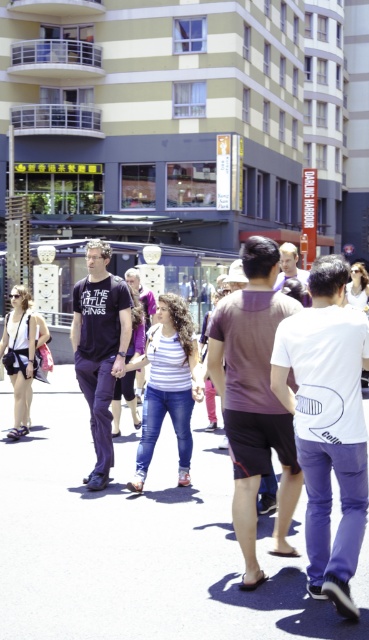
Based on the photo, who is more forward, (338, 275) or (247, 344)?

Positioned in front is point (338, 275).

Can you confirm if white matte shirt at center is positioned below purple matte shorts at center?

Yes, white matte shirt at center is below purple matte shorts at center.

You are a GUI agent. You are given a task and a screenshot of the screen. Output one action in this format:
    pyautogui.click(x=<x>, y=<y>)
    Task: Click on the white matte shirt at center
    
    Given the screenshot: What is the action you would take?
    pyautogui.click(x=328, y=424)

Can you confirm if white concrete pavement at center is smaller than purple matte shorts at center?

Incorrect, white concrete pavement at center is not smaller in size than purple matte shorts at center.

Does point (170, 516) lie in front of point (257, 323)?

No, it is not.

Image resolution: width=369 pixels, height=640 pixels. What are the coordinates of `white concrete pavement at center` in the screenshot? It's located at (139, 540).

I want to click on white matte shirt at center, so click(x=328, y=424).

Describe the element at coordinates (328, 424) in the screenshot. The width and height of the screenshot is (369, 640). I see `white matte shirt at center` at that location.

This screenshot has height=640, width=369. What are the coordinates of `white matte shirt at center` in the screenshot? It's located at (328, 424).